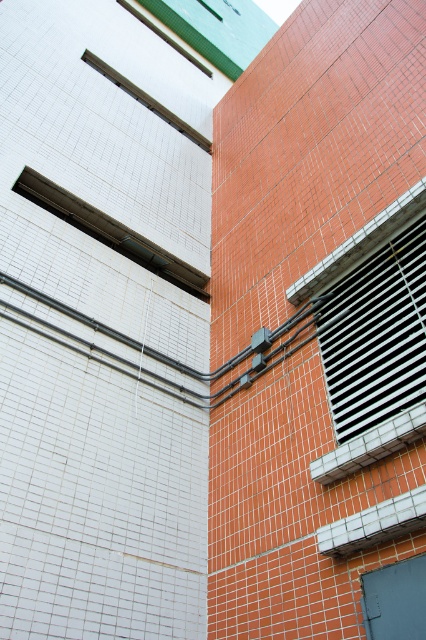
Does black metal window at right have a lesser width compared to matte glass window at upper center?

Result: Indeed, black metal window at right has a lesser width compared to matte glass window at upper center.

What do you see at coordinates (377, 336) in the screenshot?
I see `black metal window at right` at bounding box center [377, 336].

Which is behind, point (383, 248) or point (98, 72)?

Point (98, 72)

Locate an element on the screen. This screenshot has width=426, height=640. black metal window at right is located at coordinates (377, 336).

Is matte glass window at upper left positioned at the back of matte glass window at upper center?

That is False.

Which of these two, matte glass window at upper left or matte glass window at upper center, stands taller?

Standing taller between the two is matte glass window at upper left.

Where is `matte glass window at upper left`? matte glass window at upper left is located at coordinates (109, 230).

Locate an element on the screen. The width and height of the screenshot is (426, 640). matte glass window at upper left is located at coordinates pyautogui.click(x=109, y=230).

Can you confirm if black metal window at right is positioned to the right of matte glass window at upper left?

Yes, black metal window at right is to the right of matte glass window at upper left.

Which is behind, point (386, 333) or point (111, 236)?

The point (111, 236) is more distant.

Where is `black metal window at right`? black metal window at right is located at coordinates (377, 336).